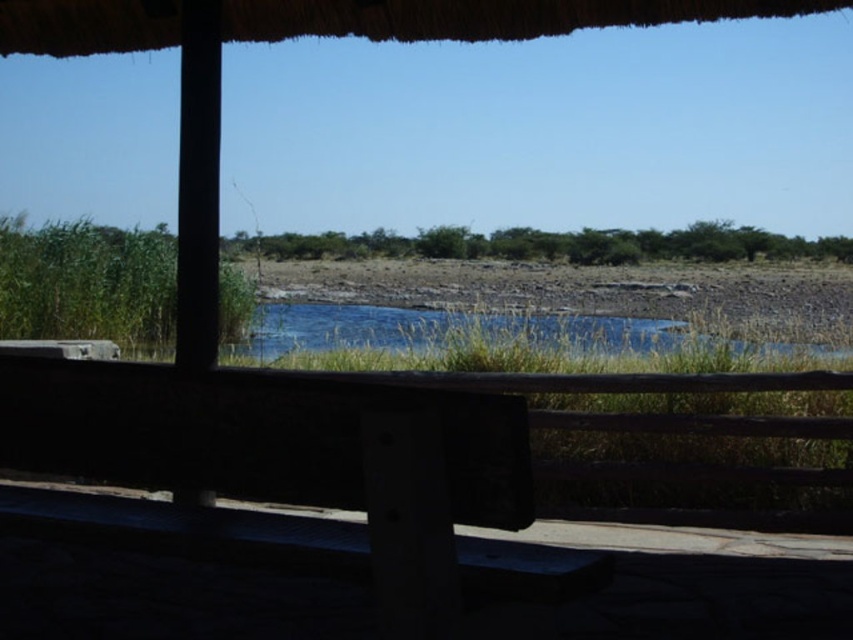
The image size is (853, 640). What do you see at coordinates (285, 472) in the screenshot?
I see `wooden bench at center` at bounding box center [285, 472].

Is wooden bench at center to the right of blue grassy river at center from the viewer's perspective?

In fact, wooden bench at center is to the left of blue grassy river at center.

Image resolution: width=853 pixels, height=640 pixels. Find the location of `wooden bench at center`. wooden bench at center is located at coordinates (285, 472).

Identify the location of wooden bench at center. Image resolution: width=853 pixels, height=640 pixels. (285, 472).